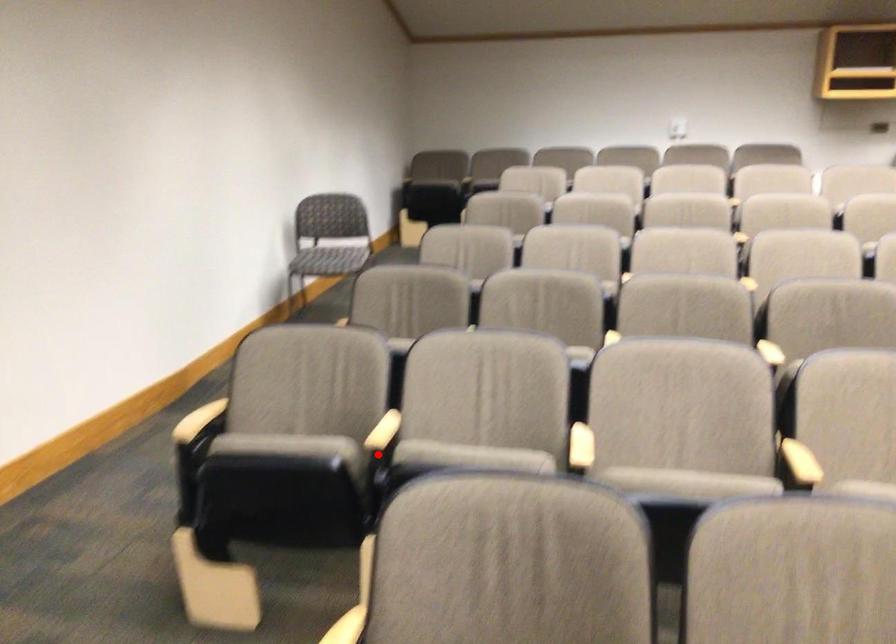
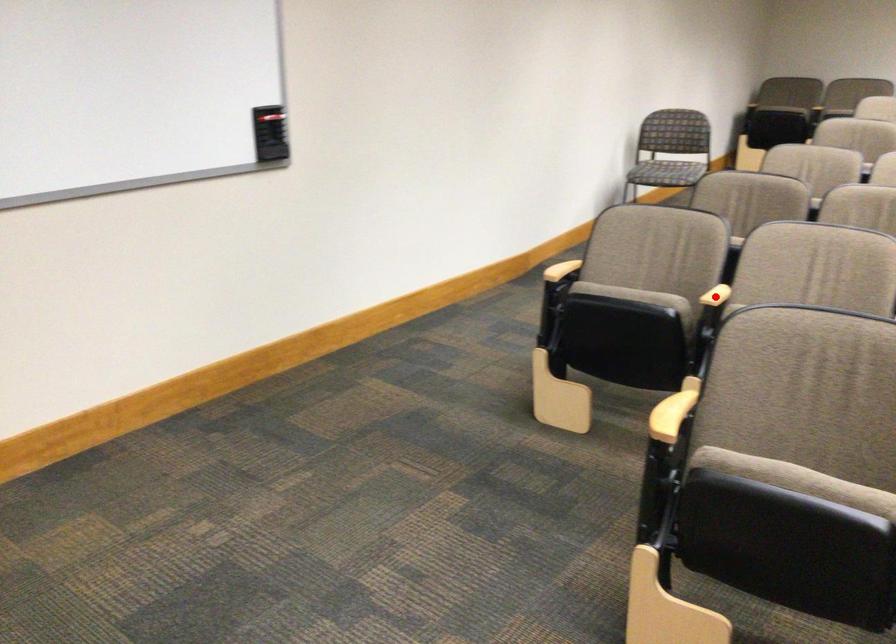
I am providing you with two images of the same scene from different viewpoints. A red point is marked on the first image and another point is marked on the second image. Is the red point in image1 aligned with the point shown in image2?

Yes